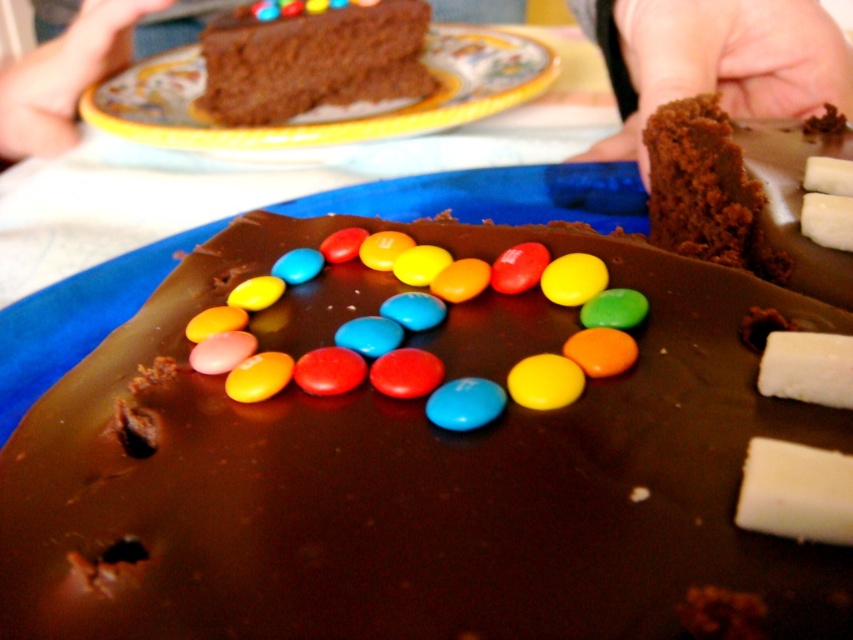
Is chocolatecrumblycake at right to the right of chocolate cake at upper left from the viewer's perspective?

Indeed, chocolatecrumblycake at right is positioned on the right side of chocolate cake at upper left.

Is chocolatecrumblycake at right smaller than chocolate cake at upper left?

Correct, chocolatecrumblycake at right occupies less space than chocolate cake at upper left.

Find the location of `chocolatecrumblycake at right`. chocolatecrumblycake at right is located at coordinates (740, 195).

Is chocolatecrumblycake at right bigger than blue glossy m&m at center?

Correct, chocolatecrumblycake at right is larger in size than blue glossy m&m at center.

Can you confirm if chocolatecrumblycake at right is taller than blue glossy m&m at center?

Correct, chocolatecrumblycake at right is much taller as blue glossy m&m at center.

This screenshot has width=853, height=640. What are the coordinates of `chocolatecrumblycake at right` in the screenshot? It's located at (740, 195).

Who is positioned more to the right, shiny chocolate candies at center or blue glossy m&m at center?

blue glossy m&m at center

Between shiny chocolate candies at center and blue glossy m&m at center, which one has less height?

blue glossy m&m at center

Is point (514, 397) behind point (480, 408)?

Yes, it is behind point (480, 408).

The image size is (853, 640). Identify the location of shiny chocolate candies at center. (434, 323).